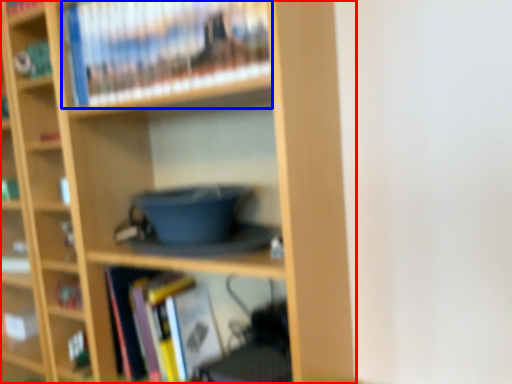
Question: Among these objects, which one is farthest to the camera, bookcase (highlighted by a red box) or book (highlighted by a blue box)?

Choices:
 (A) bookcase
 (B) book

Answer: (B)